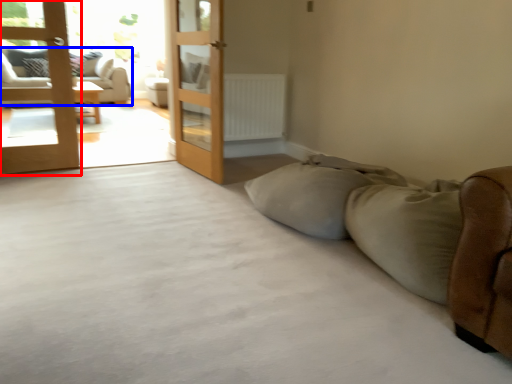
Question: Which point is closer to the camera, door (highlighted by a red box) or studio couch (highlighted by a blue box)?

Choices:
 (A) door
 (B) studio couch

Answer: (A)